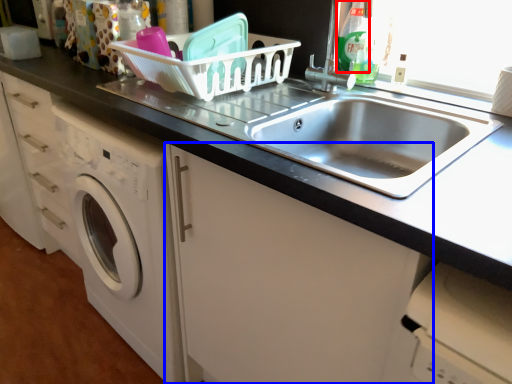
Question: Among these objects, which one is nearest to the camera, cleaning product (highlighted by a red box) or cabinetry (highlighted by a blue box)?

Choices:
 (A) cleaning product
 (B) cabinetry

Answer: (B)